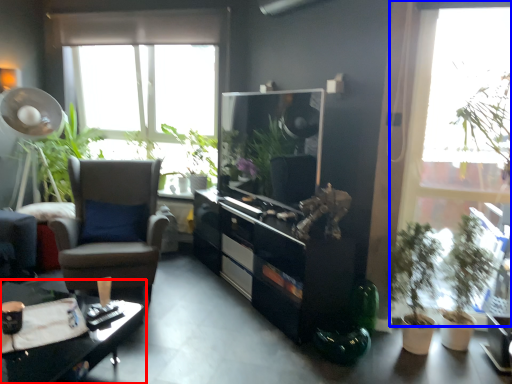
Question: Which of the following is the farthest to the observer, desk (highlighted by a red box) or window (highlighted by a blue box)?

Choices:
 (A) desk
 (B) window

Answer: (B)